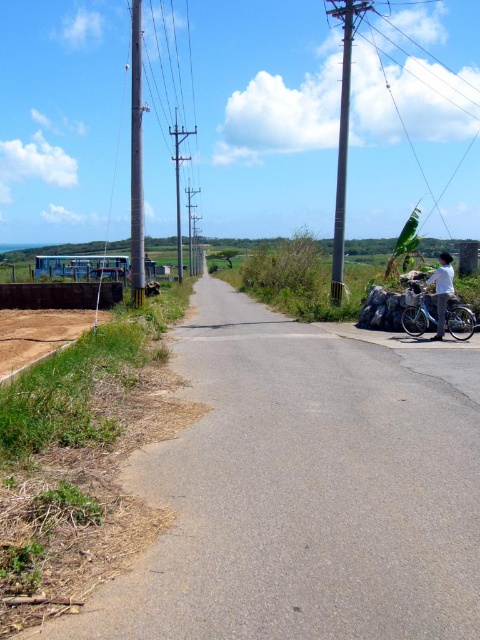
You are a cyclist standing next to the silver metallic bicycle at right. You want to take a photo of the bus parked behind the wall on the left side of the road. The camera is located somewhere in the scene. Can you reach the camera from your current position without moving the bicycle? Please explain your reasoning.

The silver metallic bicycle at right and the camera are 44.23 feet apart. Since the distance between them is significant, you would need to move towards the camera, which is 44.23 feet away, to take the photo. However, the question specifies not moving the bicycle, but you can move yourself to the camera as long as the bicycle stays in place. Therefore, yes, you can reach the camera and take the photo by walking to it while leaving the bicycle where it is.

You are driving a car and see two points on the road ahead. The first point is at coordinate point (420, 292), and the second point is at coordinate point (178, 280). Which point is closer to your current position?

Point (420, 292) is in front of point (178, 280), so the closer point to your current position is point (178, 280).